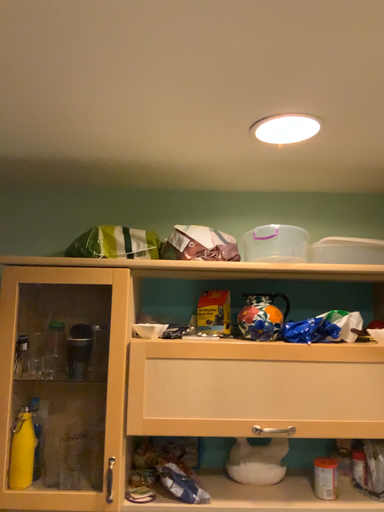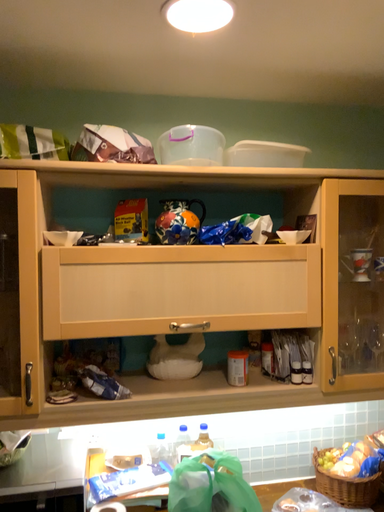
Question: Which way did the camera rotate in the video?

Choices:
 (A) rotated upward
 (B) rotated downward

Answer: (B)